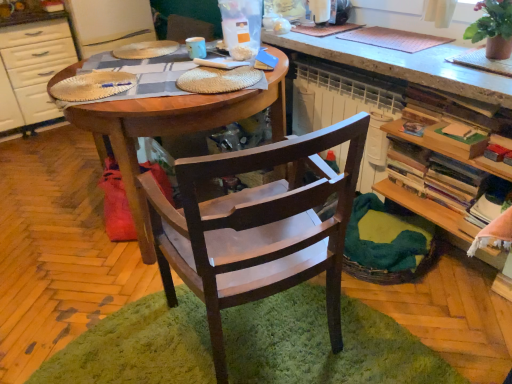
Find the location of `free space between wooden table at center and green shaggy rug at center`. free space between wooden table at center and green shaggy rug at center is located at coordinates (116, 277).